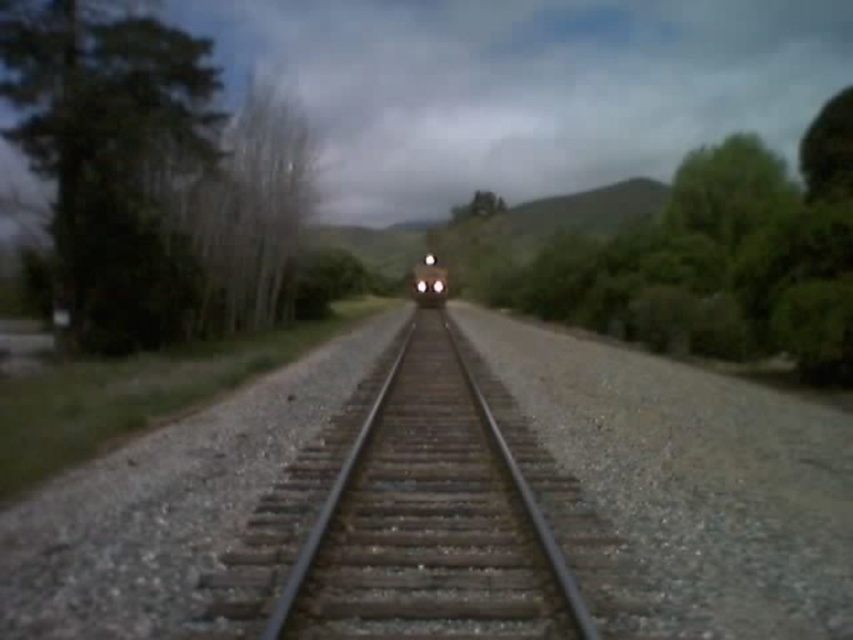
Is point (814, 278) positioned behind point (422, 260)?

That is False.

Find the location of a particular element. green leafy tree at right is located at coordinates (720, 259).

Is green leafy tree at left above matte black train at center?

Correct, green leafy tree at left is located above matte black train at center.

Based on the photo, which is above, green leafy tree at left or matte black train at center?

green leafy tree at left is above.

Image resolution: width=853 pixels, height=640 pixels. Find the location of `green leafy tree at left`. green leafy tree at left is located at coordinates (154, 173).

Does green leafy tree at right have a lesser width compared to shiny silver train at center?

Incorrect, green leafy tree at right's width is not less than shiny silver train at center's.

Who is taller, green leafy tree at right or shiny silver train at center?

green leafy tree at right is taller.

Between point (827, 224) and point (422, 268), which one is positioned behind?

The point (422, 268) is behind.

Where is `green leafy tree at right`? The height and width of the screenshot is (640, 853). green leafy tree at right is located at coordinates (720, 259).